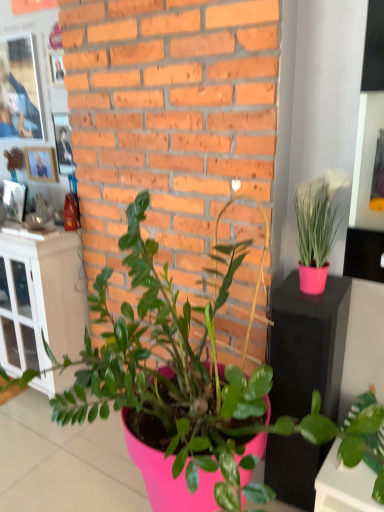
At what (x,y) coordinates should I click in order to perform the action: click on wooden photo frame at upper left. Please return your answer as a coordinate pair (x, y). The image size is (384, 512). Looking at the image, I should click on (41, 164).

In order to face wooden photo frame at upper left, should I rotate leftwards or rightwards?

You should rotate left by 19.471 degrees.

Measure the distance between green matte plant at lower right, positioned as the first houseplant in right-to-left order, and camera.

The distance of green matte plant at lower right, positioned as the first houseplant in right-to-left order, from camera is 3.82 feet.

This screenshot has width=384, height=512. I want to click on green matte plant at lower right, positioned as the first houseplant in right-to-left order, so click(x=346, y=484).

Locate an element on the screen. This screenshot has height=512, width=384. wooden photo frame at upper left is located at coordinates (41, 164).

Is white glass cabinet at left positioned with its back to pink matte plant at center, the 2th houseplant viewed from the right?

No, white glass cabinet at left is not facing the opposite direction of pink matte plant at center, the 2th houseplant viewed from the right.

From the picture: Would you say white glass cabinet at left is outside pink matte plant at center, acting as the first houseplant starting from the left?

Absolutely, white glass cabinet at left is external to pink matte plant at center, acting as the first houseplant starting from the left.

Considering the relative positions of white glass cabinet at left and pink matte plant at center, the 2th houseplant viewed from the right, in the image provided, is white glass cabinet at left behind pink matte plant at center, the 2th houseplant viewed from the right,?

Yes, the depth of white glass cabinet at left is greater than that of pink matte plant at center, the 2th houseplant viewed from the right.

Considering the positions of objects white glass cabinet at left and pink matte plant at center, acting as the first houseplant starting from the left, in the image provided, who is more to the right, white glass cabinet at left or pink matte plant at center, acting as the first houseplant starting from the left,?

Positioned to the right is pink matte plant at center, acting as the first houseplant starting from the left.

Is point (353, 477) less distant than point (51, 385)?

Yes.

Could you tell me if green matte plant at lower right, the second houseplant when ordered from left to right, is turned towards white glass cabinet at left?

No, green matte plant at lower right, the second houseplant when ordered from left to right, does not turn towards white glass cabinet at left.

I want to click on the 1st houseplant directly above the white glass cabinet at left (from a real-world perspective), so click(346, 484).

Can you confirm if green matte plant at lower right, the second houseplant when ordered from left to right, is taller than white glass cabinet at left?

In fact, green matte plant at lower right, the second houseplant when ordered from left to right, may be shorter than white glass cabinet at left.

Is green matte plant at lower right, the second houseplant when ordered from left to right, not near pink matte plant at center, the 2th houseplant viewed from the right?

No.

Locate an element on the screen. The height and width of the screenshot is (512, 384). houseplant on the left of green matte plant at lower right, the second houseplant when ordered from left to right is located at coordinates (185, 386).

Based on the photo, how different are the orientations of green matte plant at lower right, positioned as the first houseplant in right-to-left order, and pink matte plant at center, the 2th houseplant viewed from the right, in degrees?

The facing directions of green matte plant at lower right, positioned as the first houseplant in right-to-left order, and pink matte plant at center, the 2th houseplant viewed from the right, are 0.53 degrees apart.

Is green matte plant at lower right, the second houseplant when ordered from left to right, turned away from pink matte plant at center, acting as the first houseplant starting from the left?

That's right, green matte plant at lower right, the second houseplant when ordered from left to right, is facing away from pink matte plant at center, acting as the first houseplant starting from the left.

Based on the photo, in the image, is green matte plant at lower right, the second houseplant when ordered from left to right, on the left side or the right side of wooden photo frame at upper left?

Clearly, green matte plant at lower right, the second houseplant when ordered from left to right, is on the right of wooden photo frame at upper left in the image.

Which of these two, green matte plant at lower right, positioned as the first houseplant in right-to-left order, or wooden photo frame at upper left, is wider?

Wider between the two is green matte plant at lower right, positioned as the first houseplant in right-to-left order.

Can you tell me how much green matte plant at lower right, the second houseplant when ordered from left to right, and wooden photo frame at upper left differ in facing direction?

They differ by 0.449 degrees in their facing directions.

Where is `picture frame behind the green matte plant at lower right, positioned as the first houseplant in right-to-left order`? This screenshot has height=512, width=384. picture frame behind the green matte plant at lower right, positioned as the first houseplant in right-to-left order is located at coordinates (41, 164).

From a real-world perspective, which object rests below the other?

white glass cabinet at left is physically lower.

Is wooden photo frame at upper left oriented towards white glass cabinet at left?

No, wooden photo frame at upper left is not turned towards white glass cabinet at left.

Do you think wooden photo frame at upper left is within white glass cabinet at left, or outside of it?

The correct answer is: outside.

Considering the positions of objects wooden photo frame at upper left and white glass cabinet at left in the image provided, who is more to the right, wooden photo frame at upper left or white glass cabinet at left?

wooden photo frame at upper left is more to the right.

Is wooden photo frame at upper left positioned beyond the bounds of green matte plant at lower right, the second houseplant when ordered from left to right?

wooden photo frame at upper left lies outside green matte plant at lower right, the second houseplant when ordered from left to right,'s area.

How different are the orientations of wooden photo frame at upper left and green matte plant at lower right, positioned as the first houseplant in right-to-left order, in degrees?

They differ by 0.449 degrees in their facing directions.

Between wooden photo frame at upper left and green matte plant at lower right, positioned as the first houseplant in right-to-left order, which one has larger width?

With larger width is green matte plant at lower right, positioned as the first houseplant in right-to-left order.

In the scene shown: Which is more to the right, wooden photo frame at upper left or green matte plant at lower right, positioned as the first houseplant in right-to-left order?

Positioned to the right is green matte plant at lower right, positioned as the first houseplant in right-to-left order.

Is wooden photo frame at upper left not within pink matte plant at center, the 2th houseplant viewed from the right?

wooden photo frame at upper left lies outside pink matte plant at center, the 2th houseplant viewed from the right,'s area.

Is wooden photo frame at upper left directly adjacent to pink matte plant at center, the 2th houseplant viewed from the right?

No, wooden photo frame at upper left is not beside pink matte plant at center, the 2th houseplant viewed from the right.

Is wooden photo frame at upper left wider than pink matte plant at center, acting as the first houseplant starting from the left?

In fact, wooden photo frame at upper left might be narrower than pink matte plant at center, acting as the first houseplant starting from the left.

The image size is (384, 512). Identify the location of the 2nd houseplant located above the white glass cabinet at left (from a real-world perspective). (185, 386).

The image size is (384, 512). Identify the location of file cabinet beneath the green matte plant at lower right, positioned as the first houseplant in right-to-left order (from a real-world perspective). (41, 298).

Looking at the image, which one is located closer to white glass cabinet at left, wooden photo frame at upper left or pink matte plant at center, acting as the first houseplant starting from the left?

Among the two, wooden photo frame at upper left is located nearer to white glass cabinet at left.

Considering their positions, is wooden photo frame at upper left positioned further to pink matte plant at center, acting as the first houseplant starting from the left, than green matte plant at lower right, positioned as the first houseplant in right-to-left order?

The object further to pink matte plant at center, acting as the first houseplant starting from the left, is wooden photo frame at upper left.

From the image, which object appears to be nearer to green matte plant at lower right, positioned as the first houseplant in right-to-left order, white glass cabinet at left or pink matte plant at center, the 2th houseplant viewed from the right?

pink matte plant at center, the 2th houseplant viewed from the right, lies closer to green matte plant at lower right, positioned as the first houseplant in right-to-left order, than the other object.

Based on their spatial positions, is white glass cabinet at left or pink matte plant at center, acting as the first houseplant starting from the left, closer to wooden photo frame at upper left?

The object closer to wooden photo frame at upper left is white glass cabinet at left.

Based on their spatial positions, is white glass cabinet at left or green matte plant at lower right, positioned as the first houseplant in right-to-left order, further from pink matte plant at center, acting as the first houseplant starting from the left?

The object further to pink matte plant at center, acting as the first houseplant starting from the left, is white glass cabinet at left.

When comparing their distances from green matte plant at lower right, positioned as the first houseplant in right-to-left order, does wooden photo frame at upper left or white glass cabinet at left seem closer?

Based on the image, white glass cabinet at left appears to be nearer to green matte plant at lower right, positioned as the first houseplant in right-to-left order.

Looking at the image, which one is located closer to green matte plant at lower right, the second houseplant when ordered from left to right, pink matte plant at center, the 2th houseplant viewed from the right, or wooden photo frame at upper left?

Based on the image, pink matte plant at center, the 2th houseplant viewed from the right, appears to be nearer to green matte plant at lower right, the second houseplant when ordered from left to right.

Looking at the image, which one is located closer to white glass cabinet at left, pink matte plant at center, the 2th houseplant viewed from the right, or green matte plant at lower right, positioned as the first houseplant in right-to-left order?

The object closer to white glass cabinet at left is pink matte plant at center, the 2th houseplant viewed from the right.

I want to click on houseplant between pink matte plant at center, the 2th houseplant viewed from the right, and white glass cabinet at left from front to back, so click(346, 484).

The image size is (384, 512). Find the location of `houseplant between pink matte plant at center, acting as the first houseplant starting from the left, and wooden photo frame at upper left in the front-back direction`. houseplant between pink matte plant at center, acting as the first houseplant starting from the left, and wooden photo frame at upper left in the front-back direction is located at coordinates (346, 484).

This screenshot has width=384, height=512. I want to click on file cabinet located between pink matte plant at center, the 2th houseplant viewed from the right, and wooden photo frame at upper left in the depth direction, so click(41, 298).

This screenshot has width=384, height=512. Find the location of `picture frame between white glass cabinet at left and green matte plant at lower right, positioned as the first houseplant in right-to-left order, from left to right`. picture frame between white glass cabinet at left and green matte plant at lower right, positioned as the first houseplant in right-to-left order, from left to right is located at coordinates (41, 164).